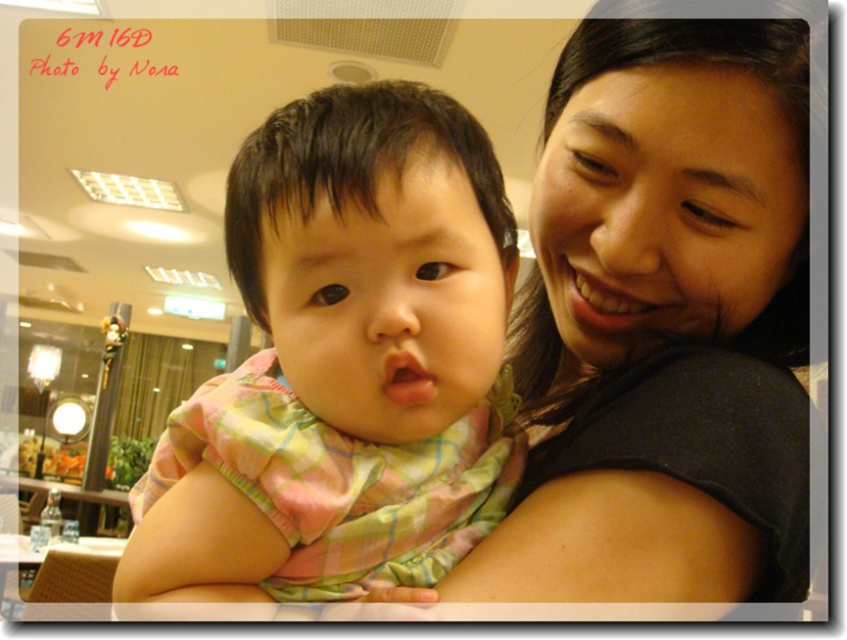
Question: Which point is closer to the camera taking this photo?

Choices:
 (A) (545, 141)
 (B) (425, 134)

Answer: (B)

Question: Which point is farther to the camera?

Choices:
 (A) matte black shirt at center
 (B) pink plaid shirt at center

Answer: (A)

Question: Which point appears farthest from the camera in this image?

Choices:
 (A) (734, 289)
 (B) (494, 164)

Answer: (A)

Question: Is the position of matte black shirt at center more distant than that of pink plaid shirt at center?

Choices:
 (A) yes
 (B) no

Answer: (A)

Question: Can you confirm if matte black shirt at center is bigger than pink plaid shirt at center?

Choices:
 (A) yes
 (B) no

Answer: (A)

Question: Is matte black shirt at center smaller than pink plaid shirt at center?

Choices:
 (A) no
 (B) yes

Answer: (A)